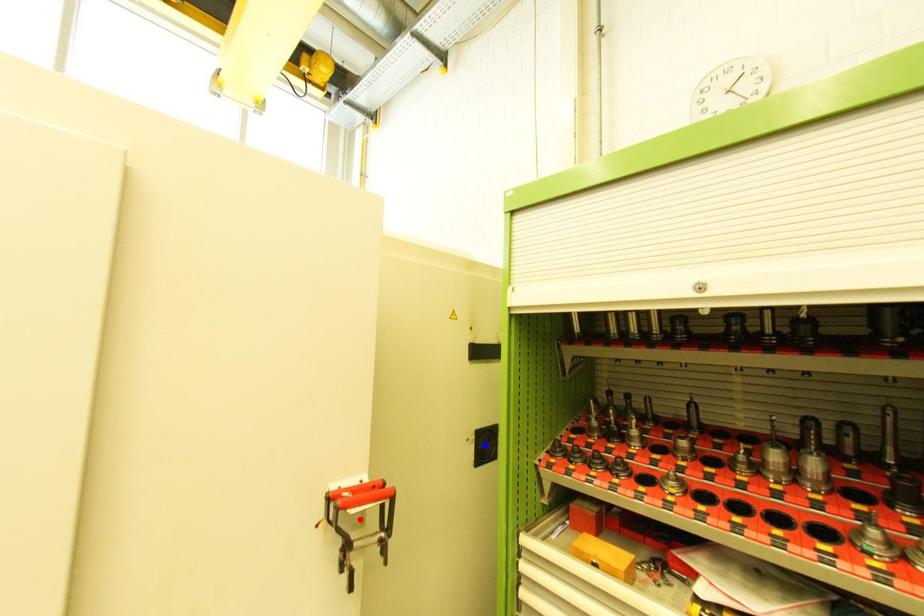
Question: Which of the two points in the image is closer to the camera?

Choices:
 (A) Blue point is closer.
 (B) Red point is closer.

Answer: (B)